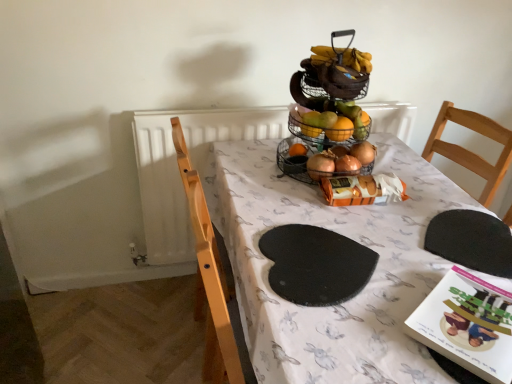
Find the location of `free region on the left part of white paper book at lower right`. free region on the left part of white paper book at lower right is located at coordinates (378, 339).